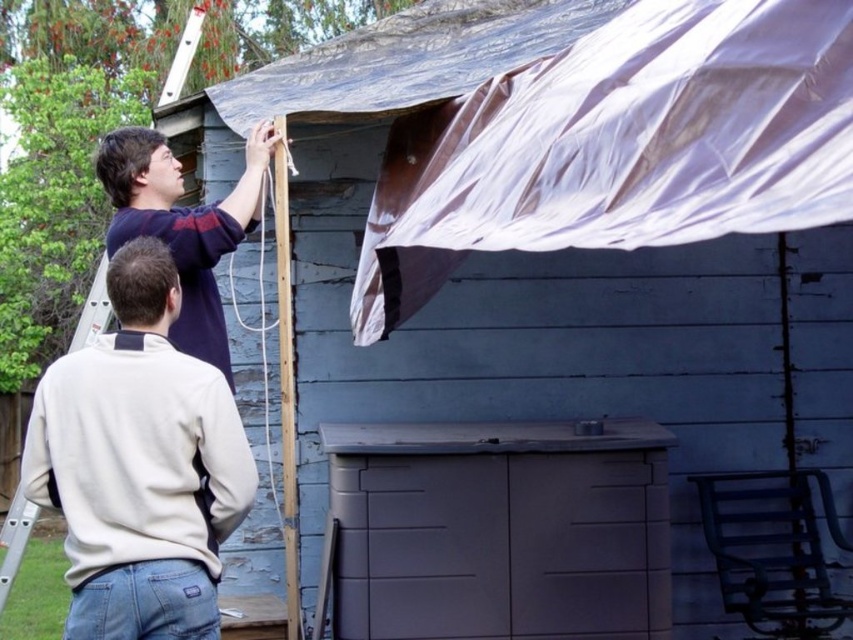
Question: Which point appears farthest from the camera in this image?

Choices:
 (A) (190, 269)
 (B) (120, 289)

Answer: (A)

Question: Which of the following is the closest to the observer?

Choices:
 (A) matte blue shirt at upper left
 (B) beige fleece sweatshirt at upper left

Answer: (B)

Question: Does beige fleece sweatshirt at upper left have a greater width compared to matte blue shirt at upper left?

Choices:
 (A) no
 (B) yes

Answer: (B)

Question: Is beige fleece sweatshirt at upper left to the left of matte blue shirt at upper left from the viewer's perspective?

Choices:
 (A) yes
 (B) no

Answer: (B)

Question: Does beige fleece sweatshirt at upper left come in front of matte blue shirt at upper left?

Choices:
 (A) yes
 (B) no

Answer: (A)